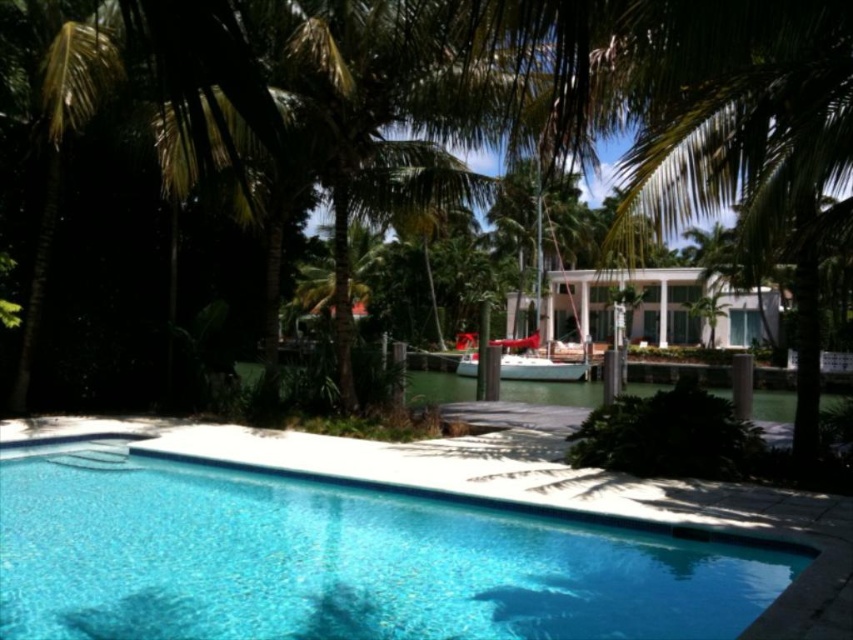
Does clear glass pool at center have a lesser height compared to green leafy palm tree at center?

Correct, clear glass pool at center is not as tall as green leafy palm tree at center.

Which is in front, point (28, 628) or point (520, 140)?

Point (28, 628)

Is point (387, 512) in front of point (711, 48)?

No, it is not.

Locate an element on the screen. clear glass pool at center is located at coordinates point(341,557).

Between green leafy palm tree at center and red plastic boat at center, which one is positioned lower?

green leafy palm tree at center is below.

Does green leafy palm tree at center appear under red plastic boat at center?

Yes.

Locate an element on the screen. The width and height of the screenshot is (853, 640). green leafy palm tree at center is located at coordinates (692, 115).

Is clear glass pool at center closer to camera compared to red plastic boat at center?

Yes, it is in front of red plastic boat at center.

Between clear glass pool at center and red plastic boat at center, which one appears on the right side from the viewer's perspective?

red plastic boat at center

What do you see at coordinates (341, 557) in the screenshot? This screenshot has height=640, width=853. I see `clear glass pool at center` at bounding box center [341, 557].

Where is `clear glass pool at center`? This screenshot has width=853, height=640. clear glass pool at center is located at coordinates (341, 557).